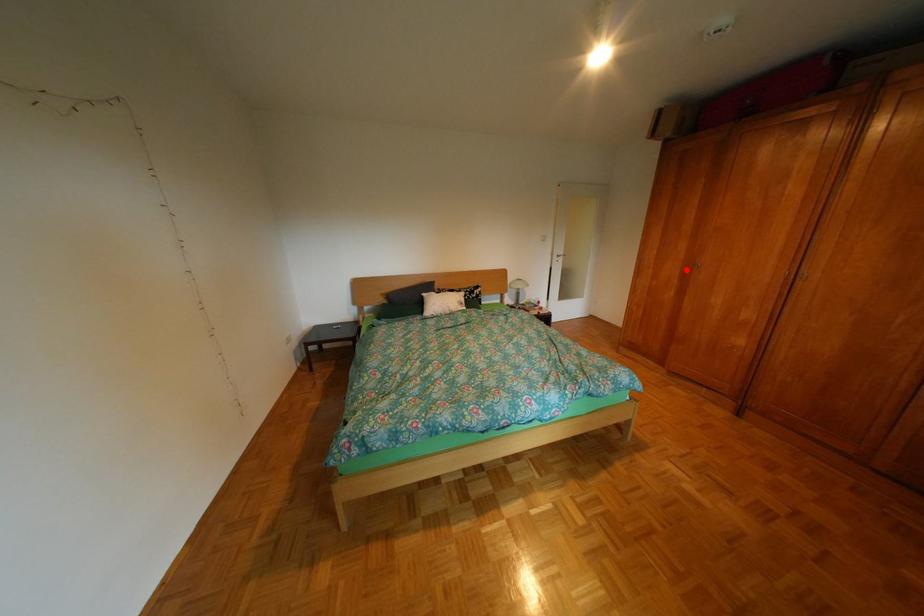
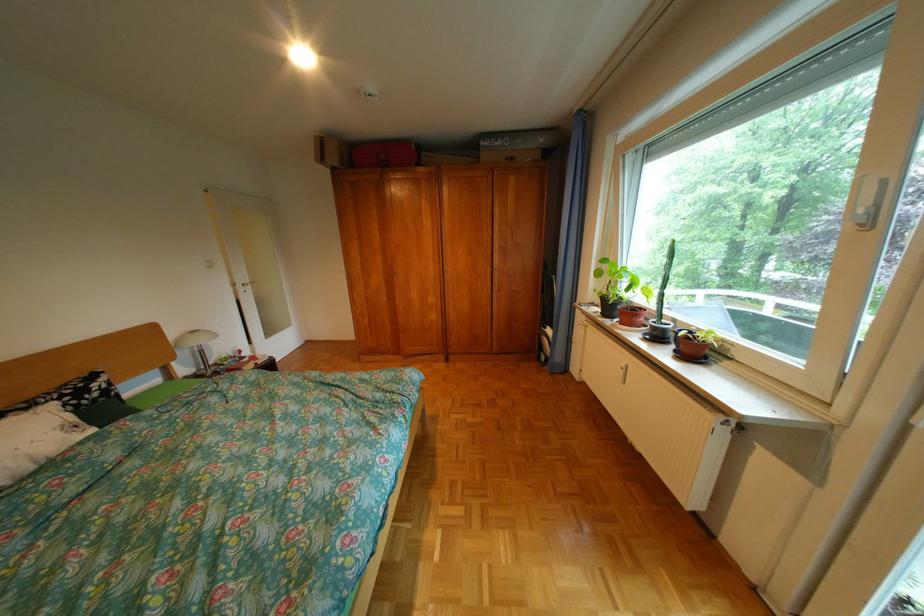
Question: I am providing you with two images of the same scene from different viewpoints. A red point is marked on the first image. Is the red point's position out of view in image 2?

Choices:
 (A) Yes
 (B) No

Answer: (B)